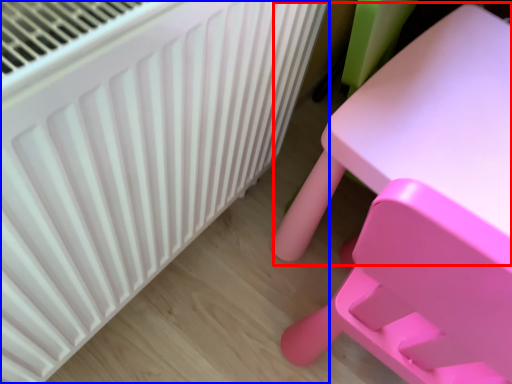
Question: Which object appears closest to the camera in this image, table (highlighted by a red box) or radiator (highlighted by a blue box)?

Choices:
 (A) table
 (B) radiator

Answer: (A)